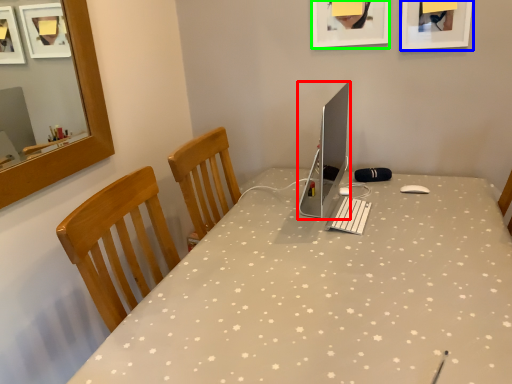
Question: Considering the real-world distances, which object is farthest from computer monitor (highlighted by a red box)? picture frame (highlighted by a blue box) or picture frame (highlighted by a green box)?

Choices:
 (A) picture frame
 (B) picture frame

Answer: (A)